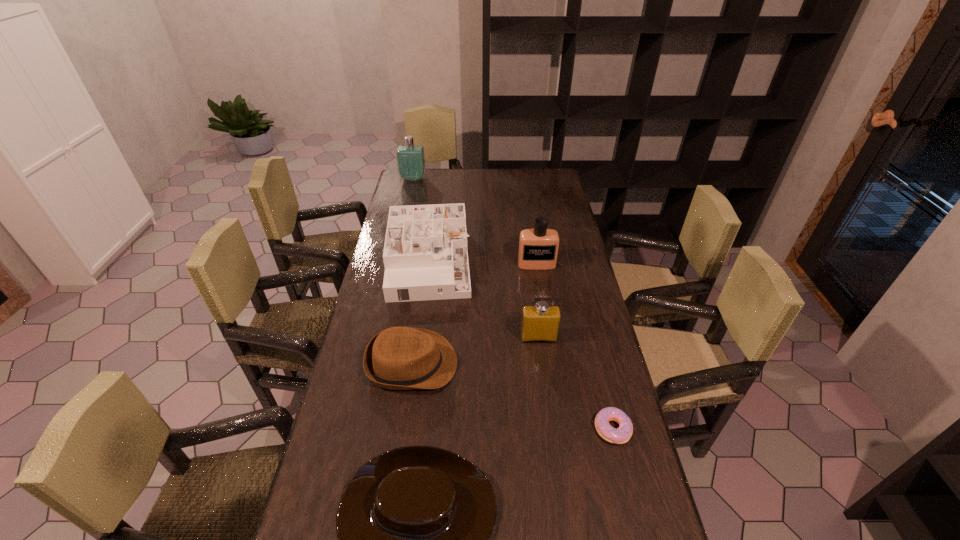
Where is `vacant region located 0.070m on the front-facing side of the nearest perfume`? vacant region located 0.070m on the front-facing side of the nearest perfume is located at coordinates (541, 361).

This screenshot has width=960, height=540. In order to click on vacant area located 0.390m on the front of the fourth shortest object in this screenshot , I will do 410,401.

Find the location of a particular element. The height and width of the screenshot is (540, 960). blank area located on the front-facing side of the third shortest object is located at coordinates (504, 364).

Locate an element on the screen. This screenshot has width=960, height=540. vacant space located on the left of the doughnut is located at coordinates pyautogui.click(x=557, y=429).

Find the location of a particular element. The image size is (960, 540). object situated at the far edge is located at coordinates (411, 163).

Identify the location of perfume at the left edge. (411, 163).

What are the coordinates of `dollhouse that is at the left edge` in the screenshot? It's located at (425, 255).

At what (x,y) coordinates should I click in order to perform the action: click on fedora situated at the left edge. Please return your answer as a coordinate pair (x, y). Image resolution: width=960 pixels, height=540 pixels. Looking at the image, I should click on (399, 358).

Image resolution: width=960 pixels, height=540 pixels. What are the coordinates of `doughnut that is positioned at the right edge` in the screenshot? It's located at (621, 435).

This screenshot has height=540, width=960. Find the location of `object that is positioned at the far left corner`. object that is positioned at the far left corner is located at coordinates (411, 163).